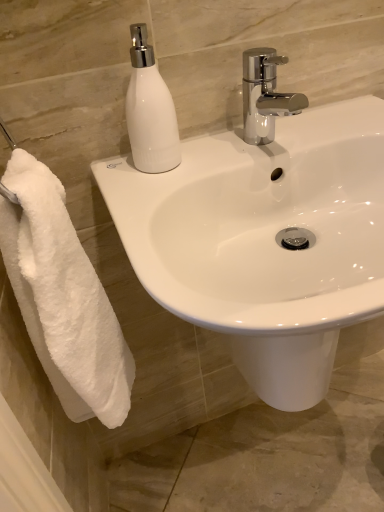
The width and height of the screenshot is (384, 512). I want to click on vacant space to the right of white glossy soap dispenser at upper left, so click(239, 148).